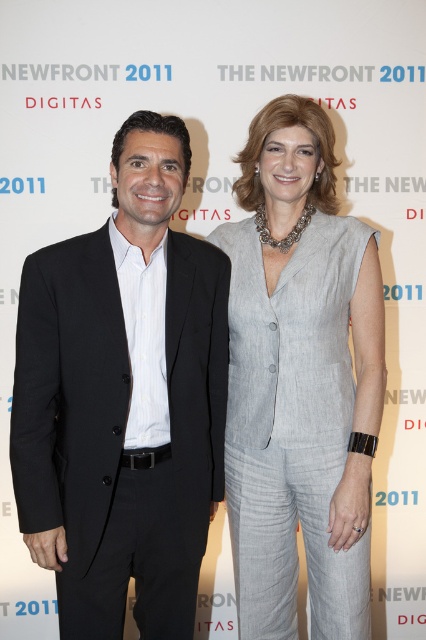
You are standing in front of the backdrop and want to place a small sticker on the point that is closer to you. Which point should you choose between point [109,612] and point [275,316]?

Point [109,612] is closer to the viewer than point [275,316], so you should choose point [109,612].

You are a photographer setting up for a group photo. You need to ensure that both the black smooth suit at left and the light gray linen suit at center are fully visible in the frame. Based on their positions and sizes, which suit might require more space to accommodate its width?

The black smooth suit at left might require more space to accommodate its width since it is wider than the light gray linen suit at center according to the description.

You are at an event and need to approach the two people in the image. The black smooth suit at left is to the left of the light gray linen suit at center. Which person should you approach first if you want to greet them in order from left to right?

You should first approach the person wearing the black smooth suit at left since it is positioned to the left of the light gray linen suit at center.